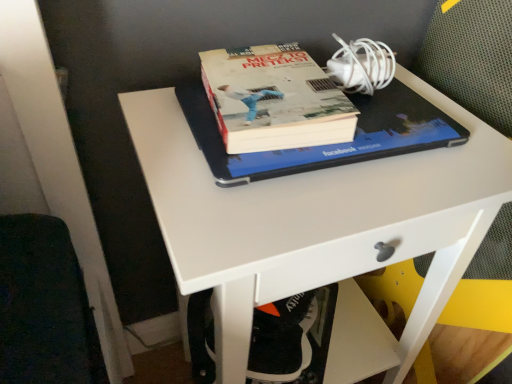
Question: In terms of height, does hardcover book at center look taller or shorter compared to white plastic swivel chair at lower center?

Choices:
 (A) tall
 (B) short

Answer: (B)

Question: From a real-world perspective, relative to white plastic swivel chair at lower center, is hardcover book at center vertically above or below?

Choices:
 (A) above
 (B) below

Answer: (A)

Question: Which object is the closest to the white plastic swivel chair at lower center?

Choices:
 (A) hardcover book at center
 (B) hardcover book at center
 (C) white matte desk at center

Answer: (C)

Question: Which object is positioned closest to the hardcover book at center?

Choices:
 (A) hardcover book at center
 (B) white plastic swivel chair at lower center
 (C) white matte desk at center

Answer: (A)